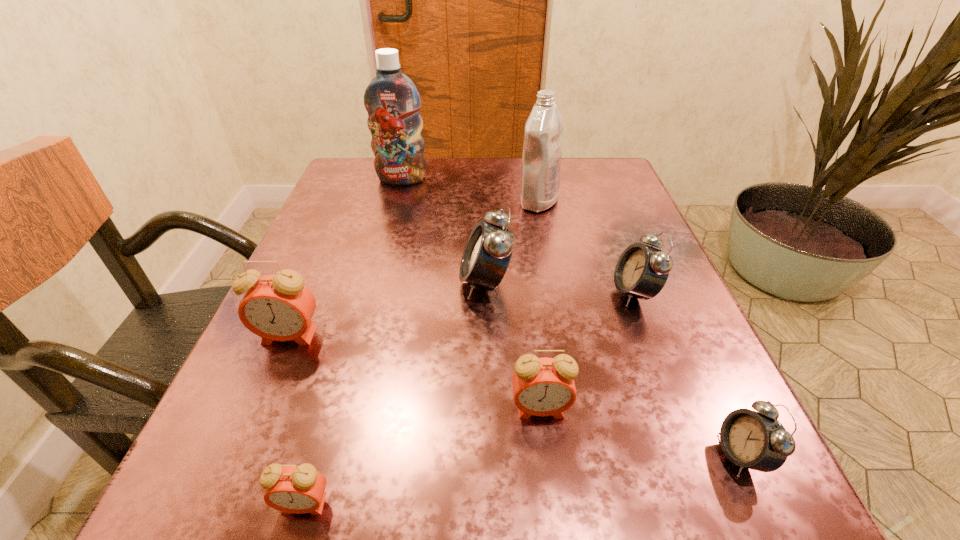
Select which object is the fifth closest to the nearest object. Please provide its 2D coordinates. Your answer should be formatted as a tuple, i.e. [(x, y)], where the tuple contains the x and y coordinates of a point satisfying the conditions above.

[(641, 271)]

This screenshot has height=540, width=960. What are the coordinates of `alarm clock that stands as the fifth closest to the fourth nearest alarm clock` in the screenshot? It's located at (755, 440).

Identify which alarm clock is the third closest to the biggest white alarm clock. Please provide its 2D coordinates. Your answer should be formatted as a tuple, i.e. [(x, y)], where the tuple contains the x and y coordinates of a point satisfying the conditions above.

[(279, 307)]

Identify which white alarm clock is located as the nearest to the second nearest pink alarm clock. Please provide its 2D coordinates. Your answer should be formatted as a tuple, i.e. [(x, y)], where the tuple contains the x and y coordinates of a point satisfying the conditions above.

[(755, 440)]

Find the location of a particular element. This screenshot has height=540, width=960. white alarm clock identified as the third closest to the nearest object is located at coordinates (641, 271).

Select which pink alarm clock is the second closest to the white detergent. Please provide its 2D coordinates. Your answer should be formatted as a tuple, i.e. [(x, y)], where the tuple contains the x and y coordinates of a point satisfying the conditions above.

[(279, 307)]

Locate an element on the screen. The width and height of the screenshot is (960, 540). pink alarm clock that is the third nearest to the second farthest object is located at coordinates (300, 489).

The image size is (960, 540). I want to click on vacant area that satisfies the following two spatial constraints: 1. on the face of the fifth farthest alarm clock; 2. on the face of the second pink alarm clock from right to left, so click(x=764, y=504).

Locate an element on the screen. The height and width of the screenshot is (540, 960). free space that satisfies the following two spatial constraints: 1. on the face of the second biggest white alarm clock; 2. on the face of the farthest pink alarm clock is located at coordinates (651, 336).